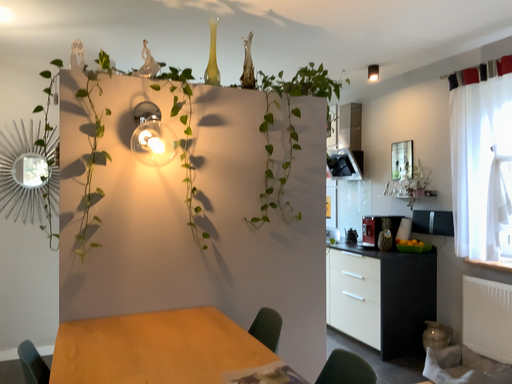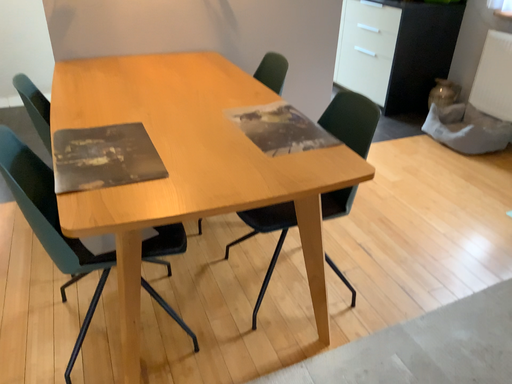
Question: Which way did the camera rotate in the video?

Choices:
 (A) rotated upward
 (B) rotated downward

Answer: (B)